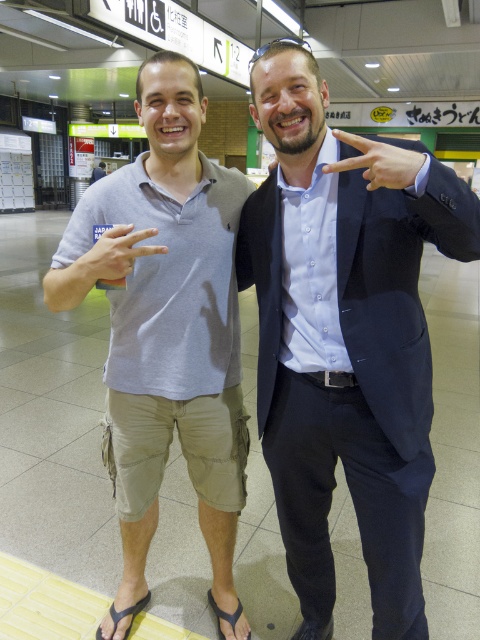
Where is `matte gray shirt at left`? The height and width of the screenshot is (640, 480). matte gray shirt at left is located at coordinates (113, 256).

Does point (113, 240) lie in front of point (226, 614)?

Yes.

The width and height of the screenshot is (480, 640). In order to click on matte gray shirt at left in this screenshot , I will do `click(113, 256)`.

Between gray cotton polo shirt at left and matte gray shirt at left, which one is positioned lower?

gray cotton polo shirt at left

Is gray cotton polo shirt at left positioned in front of matte gray shirt at left?

No, it is behind matte gray shirt at left.

Where is `gray cotton polo shirt at left`? This screenshot has height=640, width=480. gray cotton polo shirt at left is located at coordinates (169, 314).

Which of these two, matte blue suit at center or matte black hand at center, stands shorter?

matte black hand at center

What do you see at coordinates (344, 346) in the screenshot? I see `matte blue suit at center` at bounding box center [344, 346].

You are a GUI agent. You are given a task and a screenshot of the screen. Output one action in this format:
    pyautogui.click(x=<x>, y=<y>)
    Task: Click on the matte blue suit at center
    The image size is (480, 640).
    Given the screenshot: What is the action you would take?
    pyautogui.click(x=344, y=346)

You are a GUI agent. You are given a task and a screenshot of the screen. Output one action in this format:
    pyautogui.click(x=<x>, y=<y>)
    Task: Click on the matte blue suit at center
    
    Given the screenshot: What is the action you would take?
    pyautogui.click(x=344, y=346)